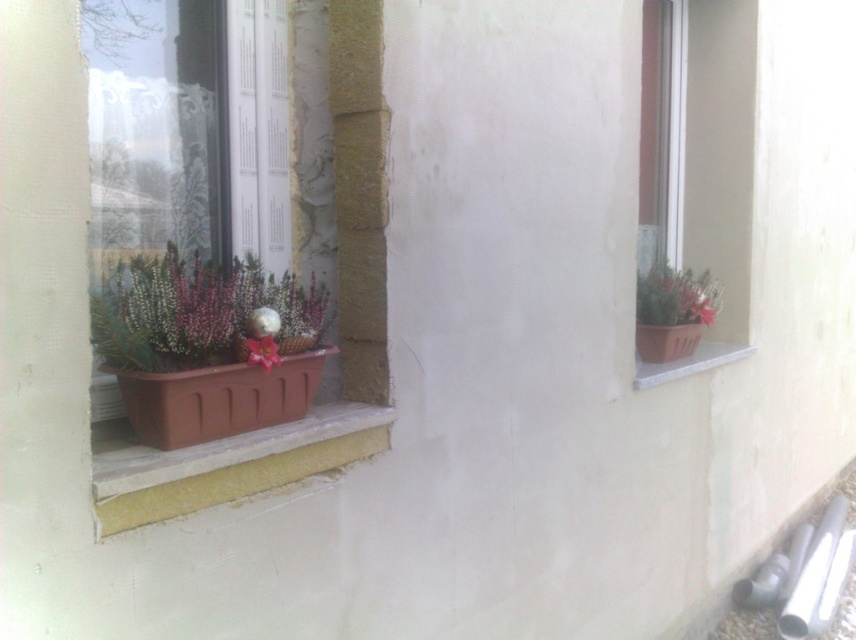
Question: Which point is closer to the camera taking this photo?

Choices:
 (A) (382, 305)
 (B) (262, 355)
 (C) (670, 360)
 (D) (174, 444)

Answer: (D)

Question: Which point is closer to the camera taking this photo?

Choices:
 (A) (361, 3)
 (B) (697, 112)
 (C) (122, 401)

Answer: (C)

Question: Does matte plastic pot at left appear over terracotta clay pot at lower left?

Choices:
 (A) no
 (B) yes

Answer: (B)

Question: Which object is closer to the camera taking this photo?

Choices:
 (A) terracotta clay pot at lower left
 (B) matte brown pot at right
 (C) brown plastic at right
 (D) brown plastic flower box at right

Answer: (A)

Question: Does brown plastic flower box at left have a larger size compared to pink matte flower at lower center?

Choices:
 (A) no
 (B) yes

Answer: (B)

Question: Does terracotta clay pot at lower left appear under brown plastic flower box at left?

Choices:
 (A) yes
 (B) no

Answer: (A)